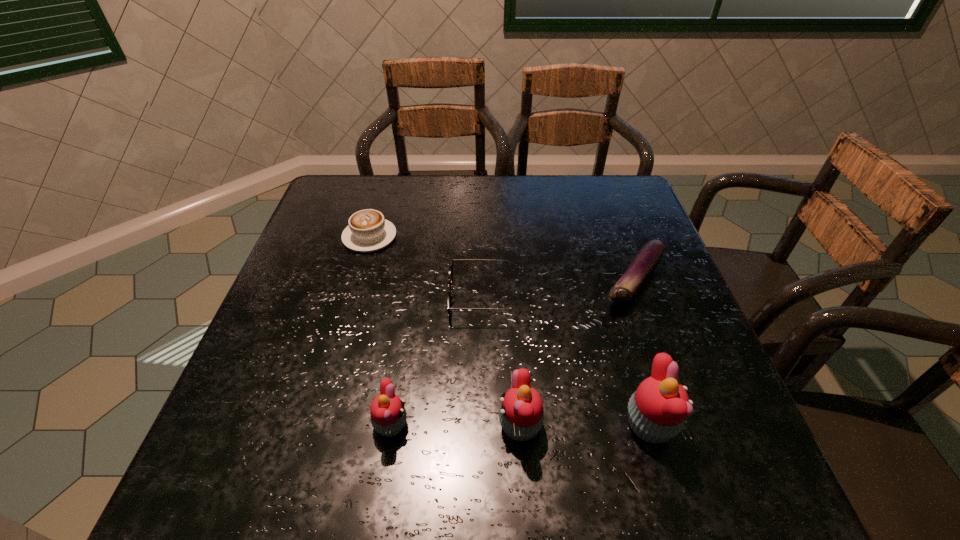
Locate an element on the screen. This screenshot has width=960, height=540. vacant space located through the lenses of the spectacles is located at coordinates (280, 298).

Identify the location of object that is at the far edge. The image size is (960, 540). (367, 231).

What are the coordinates of `object that is at the left edge` in the screenshot? It's located at pos(367,231).

Identify the location of cupcake present at the right edge. (656, 412).

You are a GUI agent. You are given a task and a screenshot of the screen. Output one action in this format:
    pyautogui.click(x=<x>, y=<y>)
    Task: Click on the eggplant at the right edge
    This screenshot has width=960, height=540.
    Given the screenshot: What is the action you would take?
    pyautogui.click(x=648, y=257)

Find the location of `object that is positioned at the far left corner`. object that is positioned at the far left corner is located at coordinates (367, 231).

I want to click on object situated at the near right corner, so click(x=656, y=412).

The width and height of the screenshot is (960, 540). Find the location of `free region at the far edge`. free region at the far edge is located at coordinates (443, 201).

The width and height of the screenshot is (960, 540). What are the coordinates of `vacant space at the near edge of the desktop` in the screenshot? It's located at (492, 423).

At what (x,y) coordinates should I click in order to perform the action: click on free space at the left edge of the desktop. Please return your answer as a coordinate pair (x, y). Image resolution: width=960 pixels, height=540 pixels. Looking at the image, I should click on (302, 335).